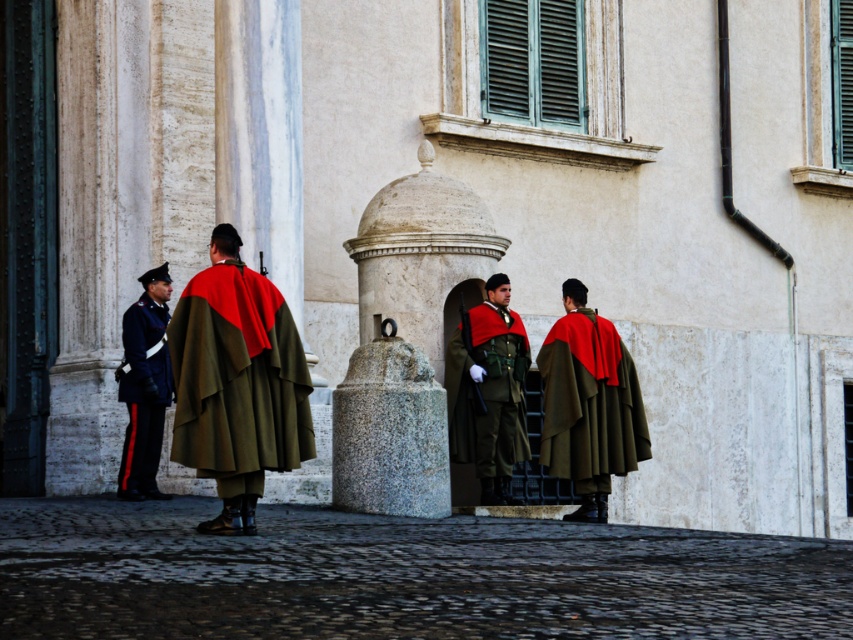
You are a visitor observing the group of individuals in front of the classical building. You notice the matte green uniform at center and the shiny black uniform at left. Which uniform is positioned to the right of the other?

The matte green uniform at center is positioned to the right of the shiny black uniform at left.